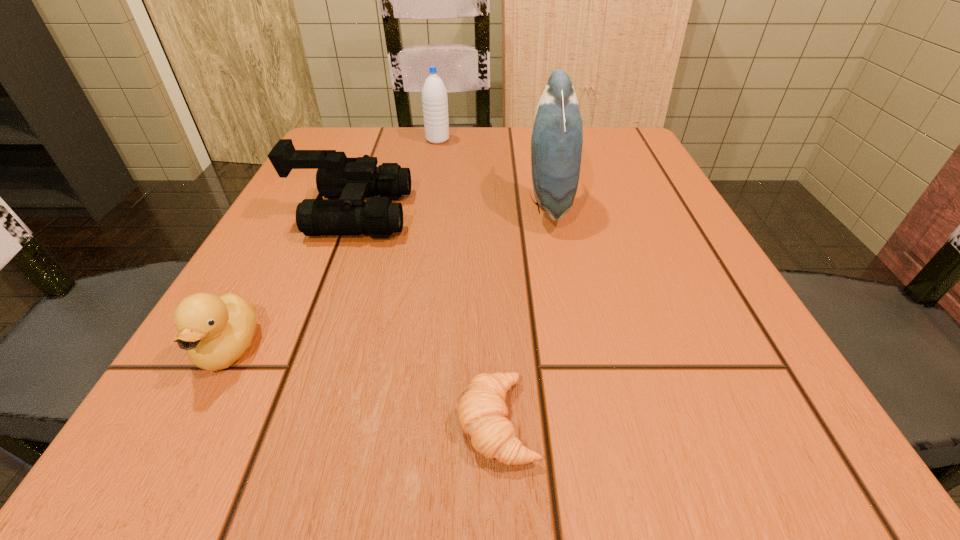
Identify the location of vacant space at the left edge. The width and height of the screenshot is (960, 540). (247, 282).

Locate an element on the screen. The width and height of the screenshot is (960, 540). free space at the right edge of the desktop is located at coordinates (643, 226).

You are a GUI agent. You are given a task and a screenshot of the screen. Output one action in this format:
    pyautogui.click(x=<x>, y=<y>)
    Task: Click on the vacant area at the far left corner
    The width and height of the screenshot is (960, 540).
    Given the screenshot: What is the action you would take?
    pyautogui.click(x=360, y=141)

In the image, there is a desktop. Where is `vacant space at the far right corner`? vacant space at the far right corner is located at coordinates (594, 127).

This screenshot has height=540, width=960. Identify the location of free area in between the second shortest object and the crescent roll. (364, 385).

At what (x,y) coordinates should I click in order to perform the action: click on free area in between the tallest object and the farthest object. Please return your answer as a coordinate pair (x, y). This screenshot has width=960, height=540. Looking at the image, I should click on (492, 171).

This screenshot has height=540, width=960. Find the location of `empty location between the shortest object and the water bottle`. empty location between the shortest object and the water bottle is located at coordinates (468, 281).

Image resolution: width=960 pixels, height=540 pixels. In order to click on free space between the duckling and the binoculars in this screenshot , I will do `click(290, 281)`.

Image resolution: width=960 pixels, height=540 pixels. I want to click on vacant area between the tallest object and the fourth tallest object, so click(x=389, y=276).

Where is `vacant space in between the fourth tallest object and the second object from right to left`? vacant space in between the fourth tallest object and the second object from right to left is located at coordinates (364, 385).